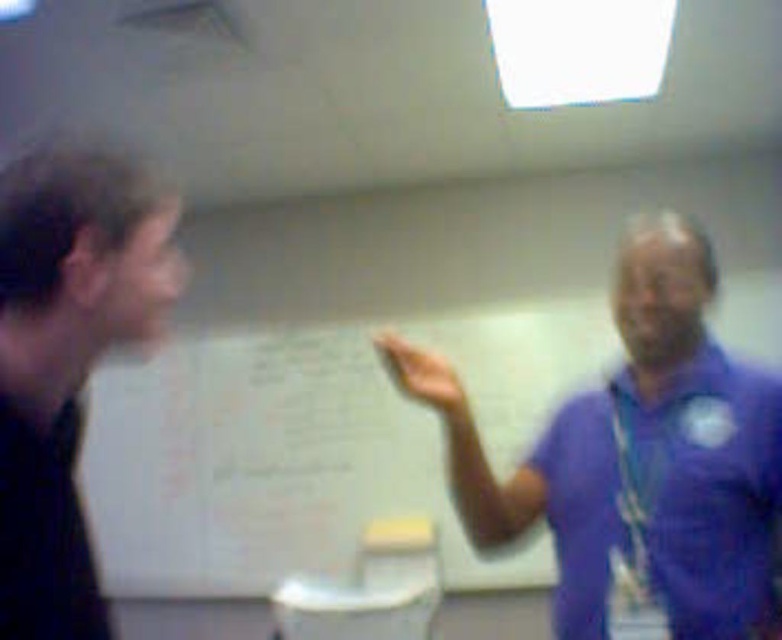
You are standing in the room and want to write a note on the white matte bulletin board at center. If your arm can reach up to 2 meters, can you reach it?

The white matte bulletin board at center is 4.11 meters away from the camera, which is farther than your arm can reach. You cannot reach it.